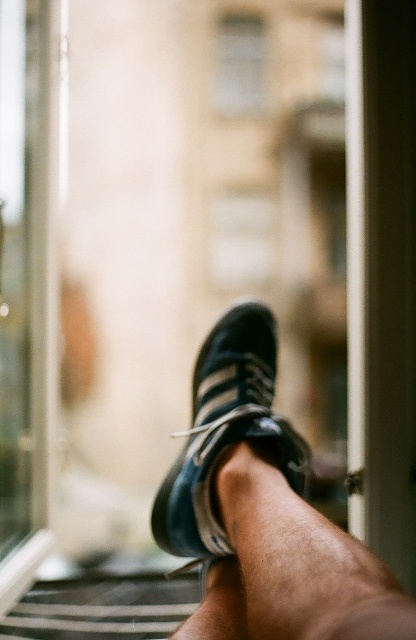
You are standing in an urban setting and notice a transparent glass door at left. Based on its position, can you determine if it is part of a building entrance or a window?

The transparent glass door at left is located at point (24, 289), which suggests it is positioned lower and to the left side of the scene. In typical urban settings, doors are often placed at ground level and near entrances, making it likely that the transparent glass door at left is part of a building entrance rather than a window.

You are a photographer adjusting the focus on your camera. You want to ensure that both points, point (349, 627) and point (4, 541), are in focus. Given that the depth of field can only sharply focus on one plane, which point should you prioritize focusing on to capture the most detailed image?

You should prioritize focusing on point (349, 627) because it is closer to the camera, ensuring it will be in sharper focus compared to point (4, 541) which is further away.

You are a photographer trying to adjust your camera to focus on the matte black sneaker at center. The camera can only focus on objects within a 0.1 radius around the point 0.75, 0.6. Will the sneaker be in focus?

The matte black sneaker at center is located at point (264,512). The distance between the sneaker and the focus point (249,480) is sqrt. Since the maximum allowed distance is 0.1, the sneaker will not be in focus.